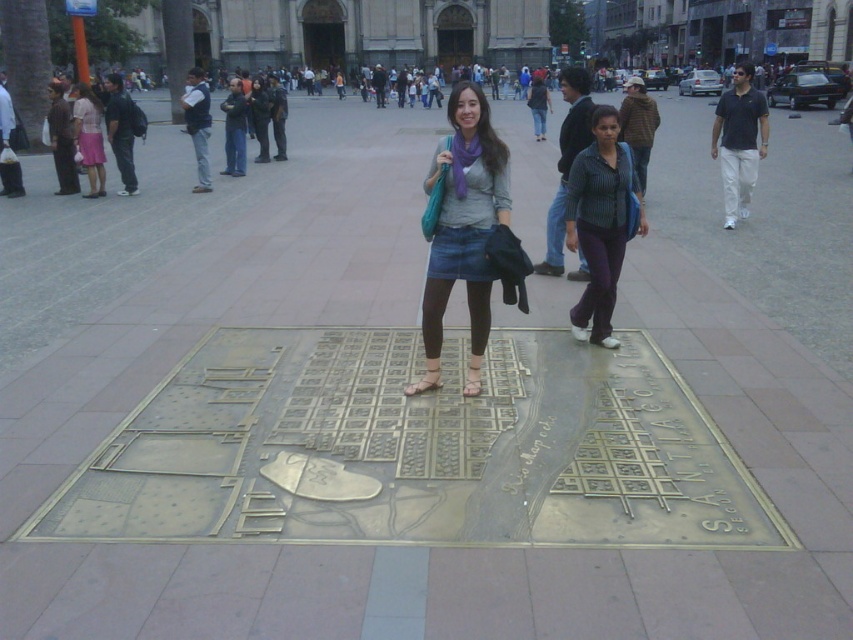
Looking at this image, you are taking a photo of the urban square and want to ensure the denim skirt at center is in the frame. What coordinates should you focus on to capture it?

The denim skirt at center is located at coordinates point [463,228], so you should focus your camera on those coordinates to ensure it is in the frame.

In the scene shown: You are a photographer trying to capture a photo of the striped fabric shirt at center and the matte pink skirt at left. Based on their positions, which one should you focus on first if you want to ensure both are in the frame without moving the camera?

The striped fabric shirt at center is below the matte pink skirt at left, so you should focus on the matte pink skirt at left first to ensure both are in the frame without moving the camera.

You are a photographer trying to capture both the denim skirt at center and the matte pink skirt at left in the same frame. Based on their positions, which skirt will appear taller in the photo?

The denim skirt at center will appear taller in the photo because it has a greater height compared to the matte pink skirt at left.